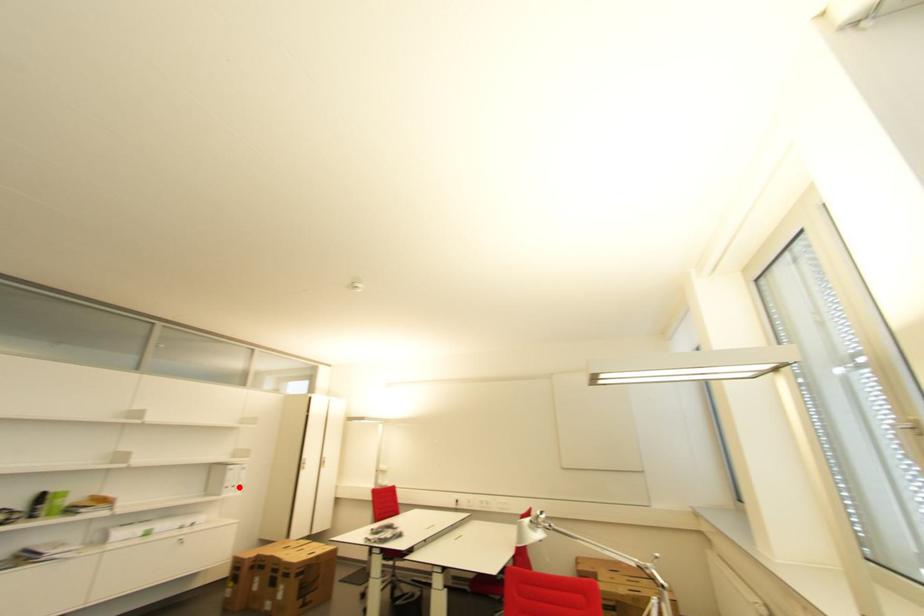
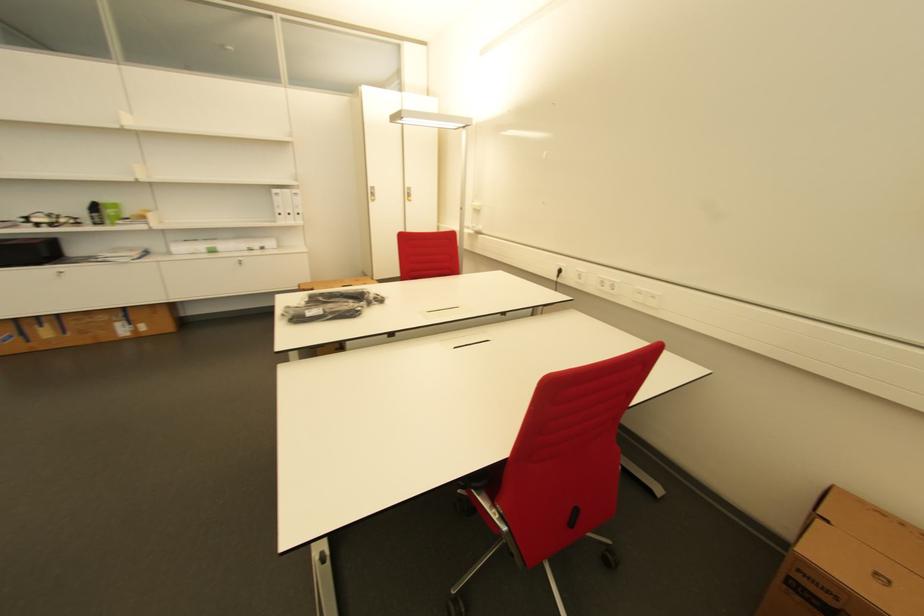
Question: I am providing you with two images of the same scene from different viewpoints. Given a red point in image1, look at the same physical point in image2. Is it:

Choices:
 (A) Closer to the viewpoint
 (B) Farther from the viewpoint

Answer: (A)